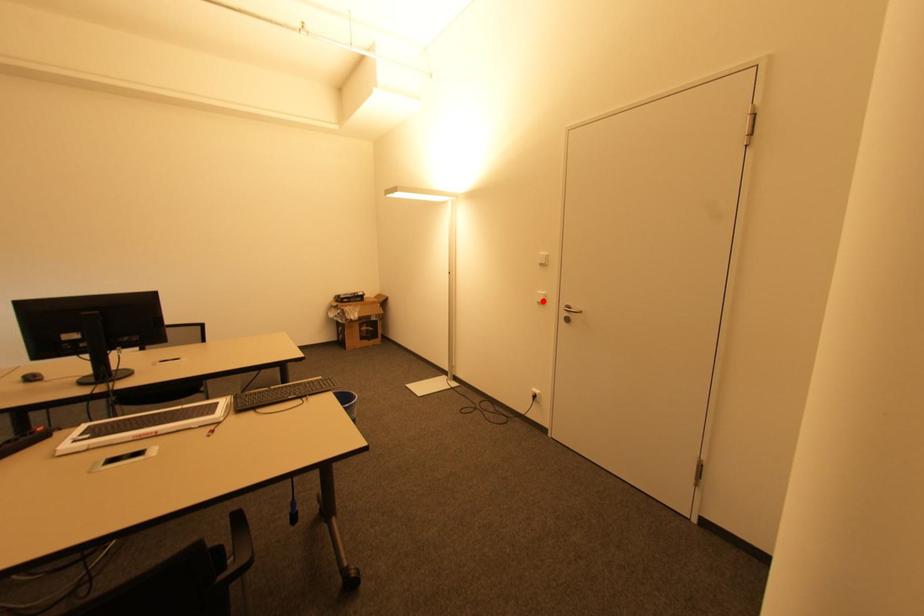
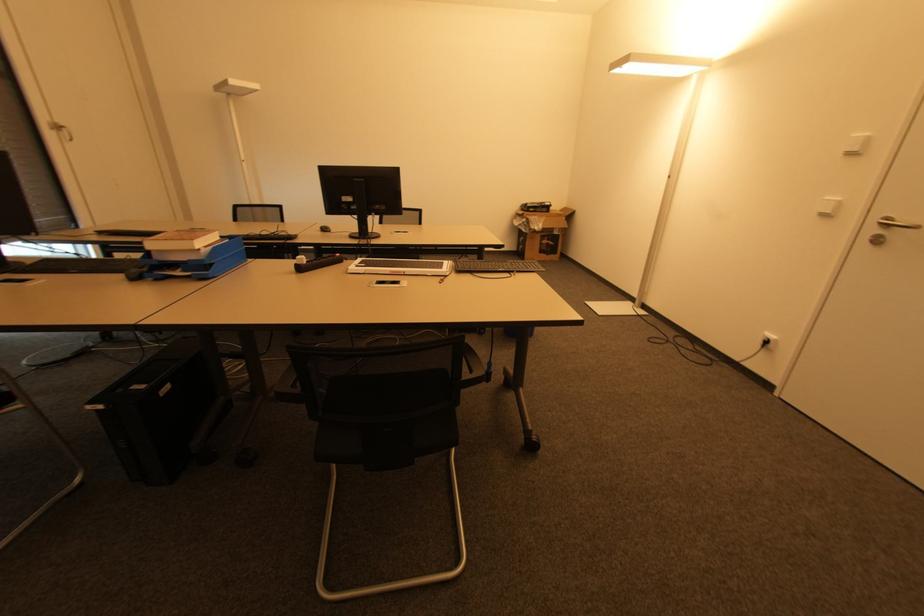
Where in the second image is the point corresponding to the highlighted location from the first image?

(832, 214)